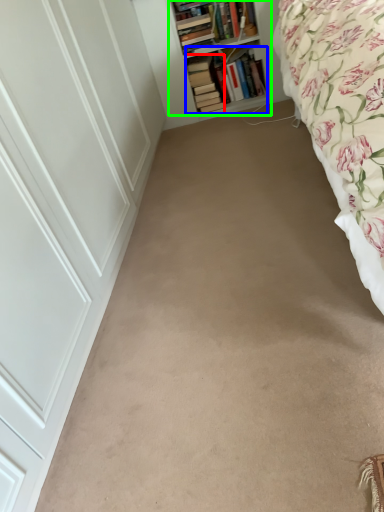
Question: Which object is the closest to the book (highlighted by a red box)? Choose among these: book (highlighted by a blue box) or shelf (highlighted by a green box).

Choices:
 (A) book
 (B) shelf

Answer: (A)